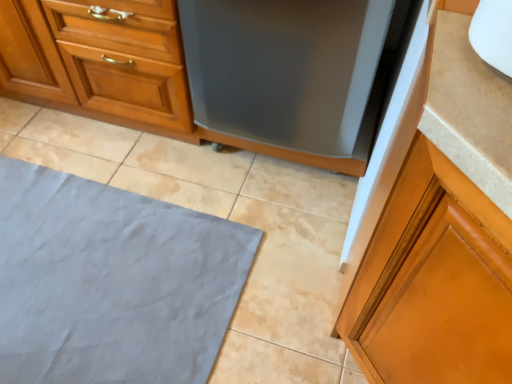
Locate an element on the screen. The width and height of the screenshot is (512, 384). vacant area that lies in front of satin black dishwasher at center is located at coordinates (278, 243).